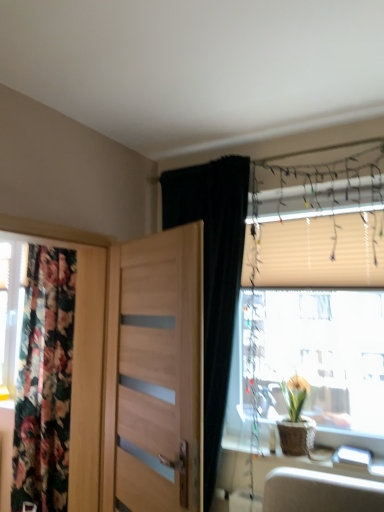
Question: Is translucent plastic window at right to the right of black velvet curtain at upper center, the 1th curtain from the right, from the viewer's perspective?

Choices:
 (A) no
 (B) yes

Answer: (B)

Question: Is translucent plastic window at right taller than black velvet curtain at upper center, the 1th curtain from the right?

Choices:
 (A) no
 (B) yes

Answer: (A)

Question: Is translucent plastic window at right not inside black velvet curtain at upper center, the 1th curtain from the right?

Choices:
 (A) yes
 (B) no

Answer: (A)

Question: Could you tell me if translucent plastic window at right is facing black velvet curtain at upper center, the 1th curtain from the right?

Choices:
 (A) no
 (B) yes

Answer: (B)

Question: Is translucent plastic window at right behind black velvet curtain at upper center, the first curtain in the front-to-back sequence?

Choices:
 (A) yes
 (B) no

Answer: (A)

Question: From a real-world perspective, is translucent plastic window at right positioned under black velvet curtain at upper center, the 1th curtain from the right, based on gravity?

Choices:
 (A) no
 (B) yes

Answer: (A)

Question: From a real-world perspective, is matte brown pot at window physically below translucent plastic window at right?

Choices:
 (A) no
 (B) yes

Answer: (B)

Question: From the image's perspective, is matte brown pot at window over translucent plastic window at right?

Choices:
 (A) no
 (B) yes

Answer: (A)

Question: Can you confirm if matte brown pot at window is thinner than translucent plastic window at right?

Choices:
 (A) yes
 (B) no

Answer: (B)

Question: Considering the relative sizes of matte brown pot at window and translucent plastic window at right in the image provided, is matte brown pot at window smaller than translucent plastic window at right?

Choices:
 (A) yes
 (B) no

Answer: (A)

Question: Considering the relative positions of matte brown pot at window and translucent plastic window at right in the image provided, is matte brown pot at window to the right of translucent plastic window at right from the viewer's perspective?

Choices:
 (A) yes
 (B) no

Answer: (B)

Question: Is matte brown pot at window facing away from translucent plastic window at right?

Choices:
 (A) no
 (B) yes

Answer: (B)

Question: From a real-world perspective, is black velvet curtain at upper center, the first curtain in the front-to-back sequence, beneath light wood door at center?

Choices:
 (A) yes
 (B) no

Answer: (B)